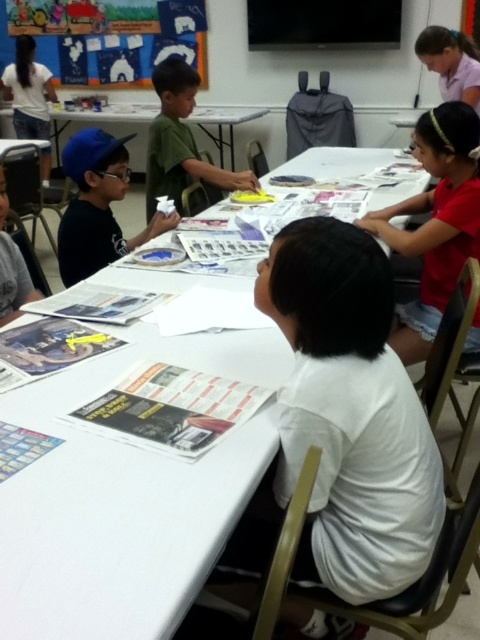
Is point (460, 128) in front of point (151, 140)?

That is True.

The width and height of the screenshot is (480, 640). What do you see at coordinates (434, 221) in the screenshot? I see `white matte shirt at upper right` at bounding box center [434, 221].

Does point (440, 243) come farther from viewer compared to point (157, 193)?

No, it is in front of (157, 193).

Where is `white matte shirt at upper right`? The height and width of the screenshot is (640, 480). white matte shirt at upper right is located at coordinates (434, 221).

Which is in front, point (115, 179) or point (237, 182)?

Point (115, 179) is in front.

Who is positioned more to the left, matte blue cap at left or green matte shirt at center?

From the viewer's perspective, matte blue cap at left appears more on the left side.

Which is behind, point (87, 252) or point (175, 113)?

The point (175, 113) is more distant.

The height and width of the screenshot is (640, 480). Identify the location of matte blue cap at left. (97, 205).

Is white paper at center behind green matte shirt at center?

That is False.

This screenshot has width=480, height=640. In order to click on white paper at center in this screenshot , I will do `click(126, 497)`.

What do you see at coordinates (126, 497) in the screenshot? This screenshot has width=480, height=640. I see `white paper at center` at bounding box center [126, 497].

Identify the location of white paper at center. This screenshot has height=640, width=480. (126, 497).